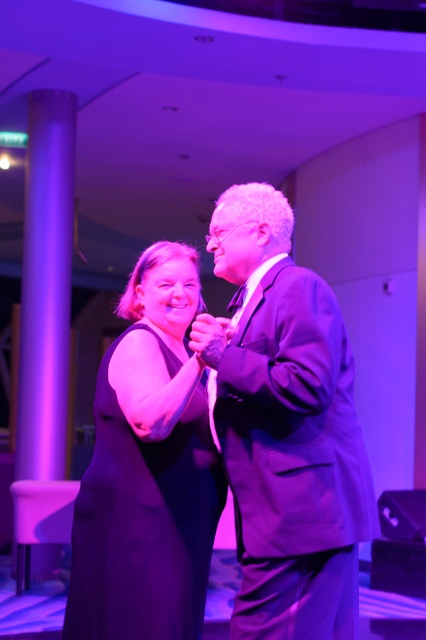
Question: Which point is farther to the camera?

Choices:
 (A) satin black suit at center
 (B) matte black dress at center

Answer: (B)

Question: Is satin black suit at center to the left of matte black dress at center from the viewer's perspective?

Choices:
 (A) no
 (B) yes

Answer: (A)

Question: Considering the relative positions of satin black suit at center and matte black dress at center in the image provided, where is satin black suit at center located with respect to matte black dress at center?

Choices:
 (A) right
 (B) left

Answer: (A)

Question: Is satin black suit at center closer to camera compared to matte black dress at center?

Choices:
 (A) no
 (B) yes

Answer: (B)